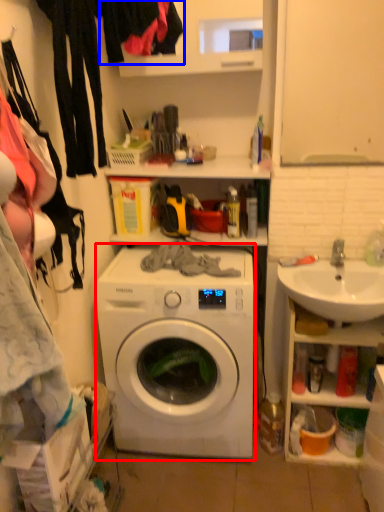
Question: Which object appears closest to the camera in this image, washing machine (highlighted by a red box) or clothing (highlighted by a blue box)?

Choices:
 (A) washing machine
 (B) clothing

Answer: (B)